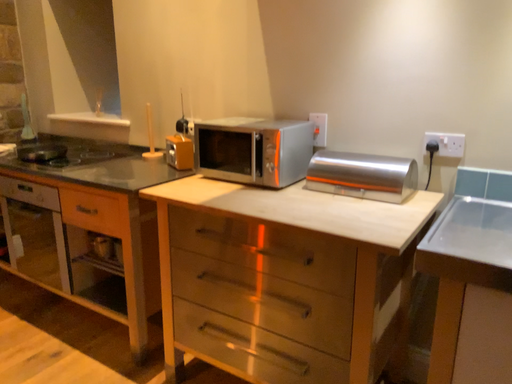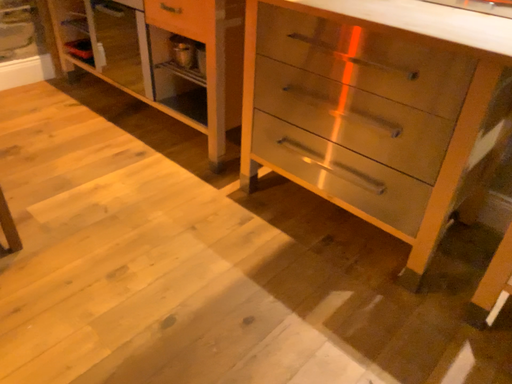
Question: How did the camera likely rotate when shooting the video?

Choices:
 (A) rotated right
 (B) rotated left

Answer: (B)